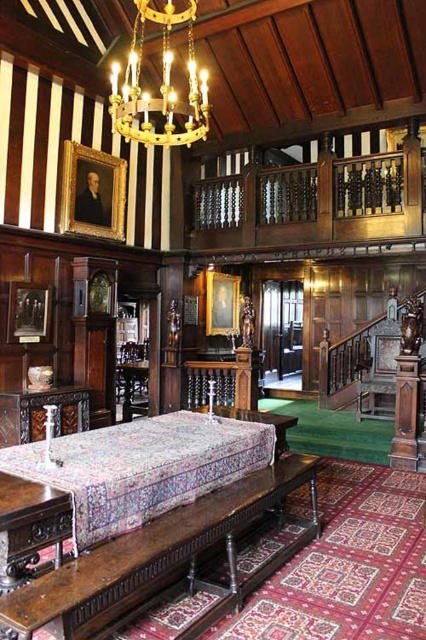
You are planning to place a large centerpiece on the polished dark wood table at center. Considering the size of the gold metallic chandelier at upper center, will the table be able to accommodate the centerpiece without it touching the chandelier?

The polished dark wood table at center is larger in size than the gold metallic chandelier at upper center, so the table has enough space to accommodate the centerpiece without it touching the chandelier.

You are standing in the grand room and want to reach a specific point marked at coordinates point (255, 576). If your current position is 10 feet away from that point, can you move forward to reach it without any obstacles?

The distance of point (255, 576) from viewer is 11.99 feet, so you are currently 10 feet away but need to cover an additional 1.99 feet to reach it. However, there might be obstacles not mentioned in the scene description that could block your path. The scene description does not provide information about any obstacles between your current position and the point, so assuming no obstacles exist, you can move forward the remaining distance to reach it.